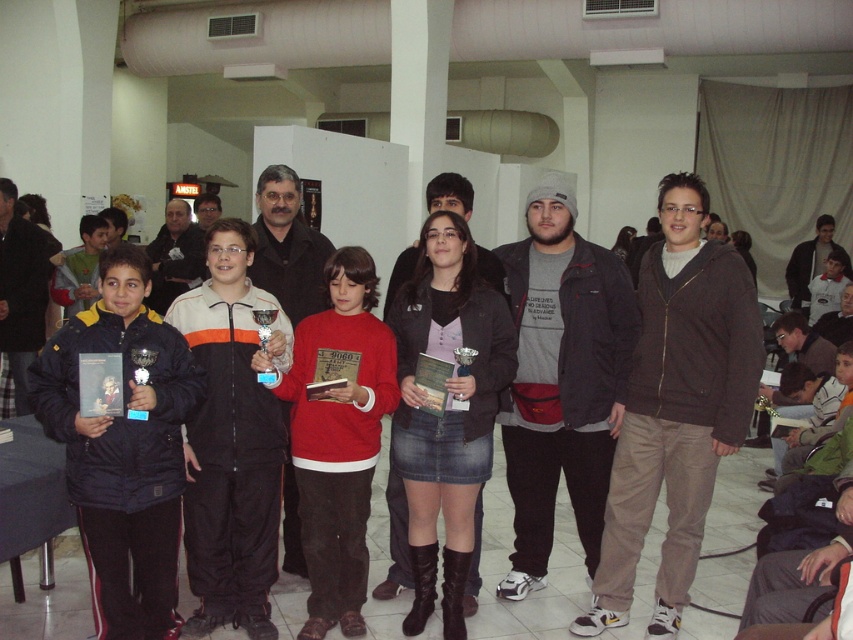
Question: Which object is positioned farthest from the red matte sweater at center?

Choices:
 (A) matte black jacket at center
 (B) black puffy jacket at left
 (C) denim skirt at center

Answer: (A)

Question: Among these points, which one is nearest to the camera?

Choices:
 (A) (306, 604)
 (B) (465, 509)
 (C) (68, 588)

Answer: (B)

Question: Where is black puffy jacket at left located in relation to red matte sweater at center in the image?

Choices:
 (A) below
 (B) above

Answer: (B)

Question: Among these points, which one is nearest to the camera?

Choices:
 (A) (144, 504)
 (B) (352, 499)
 (C) (415, 497)

Answer: (A)

Question: Considering the relative positions of matte black jacket at center and denim skirt at center in the image provided, where is matte black jacket at center located with respect to denim skirt at center?

Choices:
 (A) right
 (B) left

Answer: (A)

Question: Is black puffy jacket at left further to the viewer compared to denim skirt at center?

Choices:
 (A) no
 (B) yes

Answer: (A)